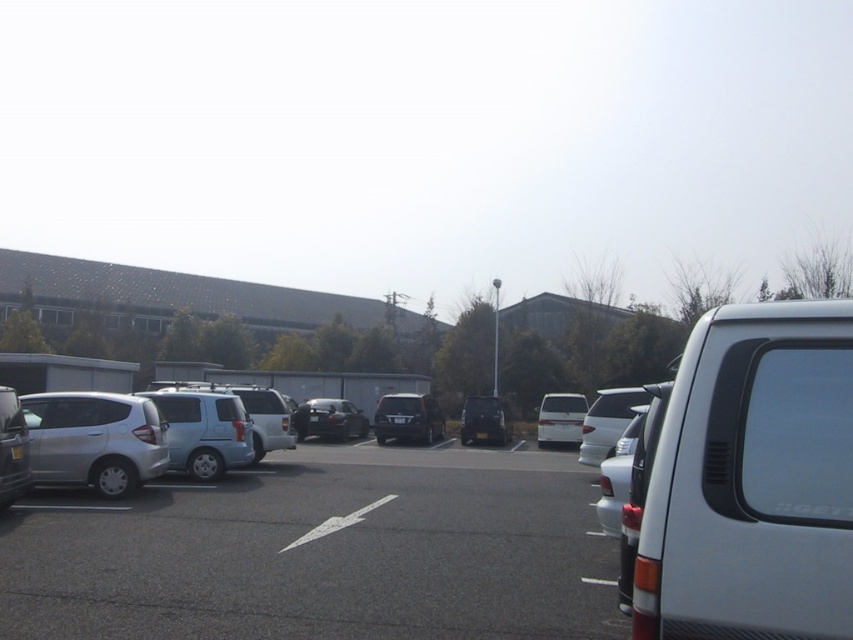
Between satin black van at center and shiny black suv at center, which one is positioned lower?

shiny black suv at center is lower down.

Between point (396, 422) and point (462, 436), which one is positioned behind?

Point (462, 436)

Where is `satin black van at center`? satin black van at center is located at coordinates (407, 419).

Who is shorter, silver metallic car at center or satin black sedan at center?

satin black sedan at center is shorter.

Is silver metallic car at center closer to camera compared to satin black sedan at center?

Yes, silver metallic car at center is in front of satin black sedan at center.

At what (x,y) coordinates should I click in order to perform the action: click on silver metallic car at center. Please return your answer as a coordinate pair (x, y). Image resolution: width=853 pixels, height=640 pixels. Looking at the image, I should click on coord(321,552).

Can you confirm if satin silver van at right is positioned above white matte van at center?

Yes.

From the picture: Does satin silver van at right have a lesser height compared to white matte van at center?

Correct, satin silver van at right is not as tall as white matte van at center.

This screenshot has width=853, height=640. I want to click on satin silver van at right, so click(x=752, y=481).

Locate an element on the screen. This screenshot has width=853, height=640. satin silver van at right is located at coordinates (752, 481).